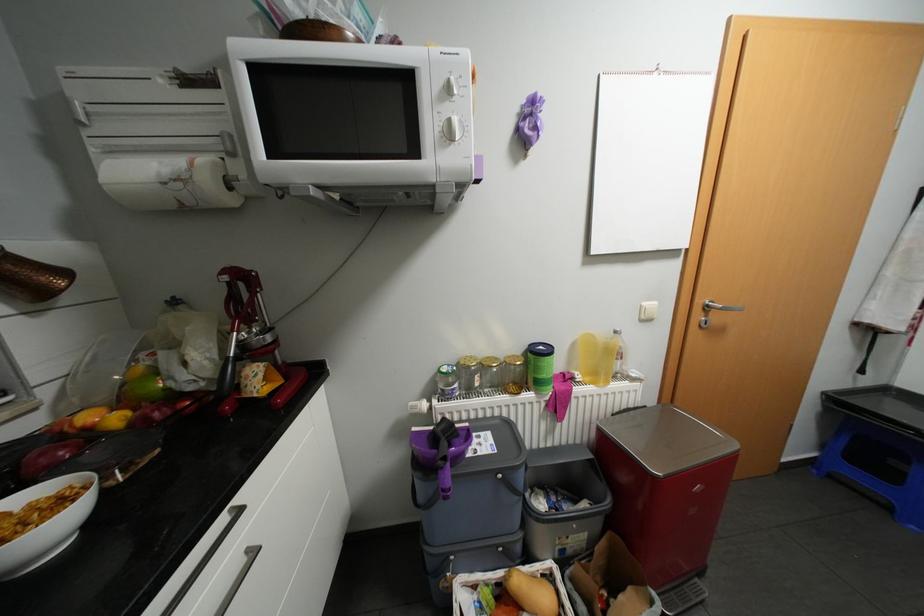
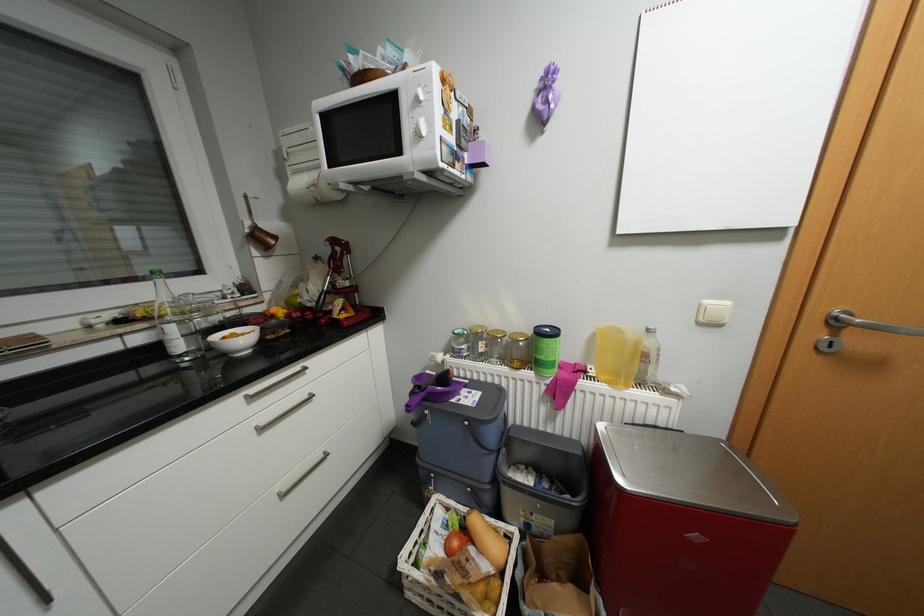
The point at (544, 392) is marked in the first image. Where is the corresponding point in the second image?

(544, 373)